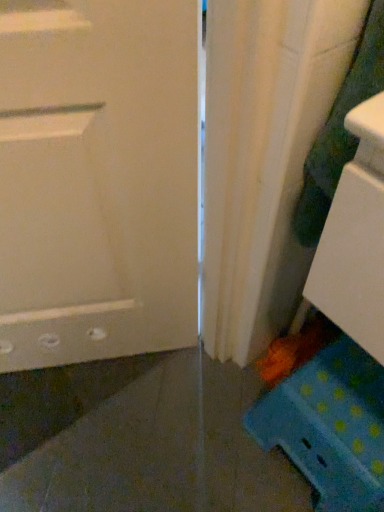
Question: Considering the relative positions of green textured fabric at right and blue polka dot stool at lower right in the image provided, is green textured fabric at right to the right of blue polka dot stool at lower right from the viewer's perspective?

Choices:
 (A) no
 (B) yes

Answer: (A)

Question: Does green textured fabric at right come behind blue polka dot stool at lower right?

Choices:
 (A) no
 (B) yes

Answer: (A)

Question: From the image's perspective, is green textured fabric at right located beneath blue polka dot stool at lower right?

Choices:
 (A) yes
 (B) no

Answer: (B)

Question: From the image's perspective, is green textured fabric at right on top of blue polka dot stool at lower right?

Choices:
 (A) no
 (B) yes

Answer: (B)

Question: Can you confirm if green textured fabric at right is thinner than blue polka dot stool at lower right?

Choices:
 (A) yes
 (B) no

Answer: (A)

Question: Is the depth of green textured fabric at right less than that of blue polka dot stool at lower right?

Choices:
 (A) no
 (B) yes

Answer: (B)

Question: Does blue polka dot stool at lower right appear on the right side of green textured fabric at right?

Choices:
 (A) yes
 (B) no

Answer: (A)

Question: Does blue polka dot stool at lower right have a smaller size compared to green textured fabric at right?

Choices:
 (A) no
 (B) yes

Answer: (A)

Question: Does blue polka dot stool at lower right have a larger size compared to green textured fabric at right?

Choices:
 (A) no
 (B) yes

Answer: (B)

Question: From a real-world perspective, is blue polka dot stool at lower right below green textured fabric at right?

Choices:
 (A) yes
 (B) no

Answer: (A)

Question: Is blue polka dot stool at lower right to the left of green textured fabric at right from the viewer's perspective?

Choices:
 (A) yes
 (B) no

Answer: (B)

Question: Can you confirm if blue polka dot stool at lower right is thinner than green textured fabric at right?

Choices:
 (A) yes
 (B) no

Answer: (B)

Question: From a real-world perspective, relative to blue polka dot stool at lower right, is green textured fabric at right vertically above or below?

Choices:
 (A) below
 (B) above

Answer: (B)